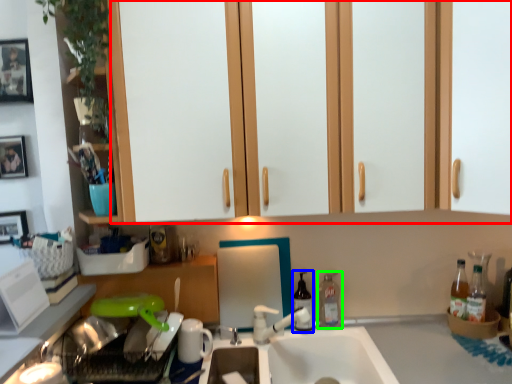
Question: Estimate the real-world distances between objects in this image. Which object is farther from dresser (highlighted by a red box), bottle (highlighted by a blue box) or bottle (highlighted by a green box)?

Choices:
 (A) bottle
 (B) bottle

Answer: (B)